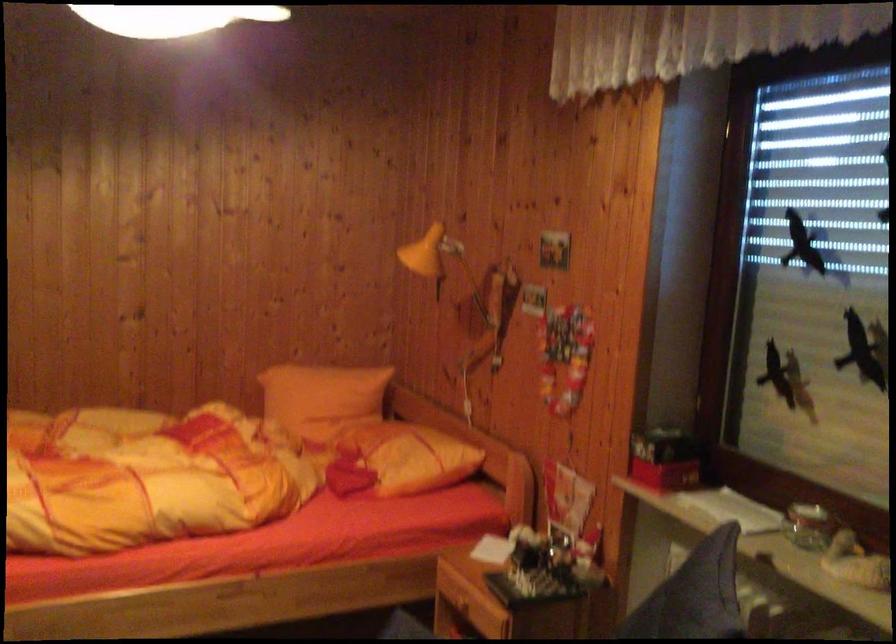
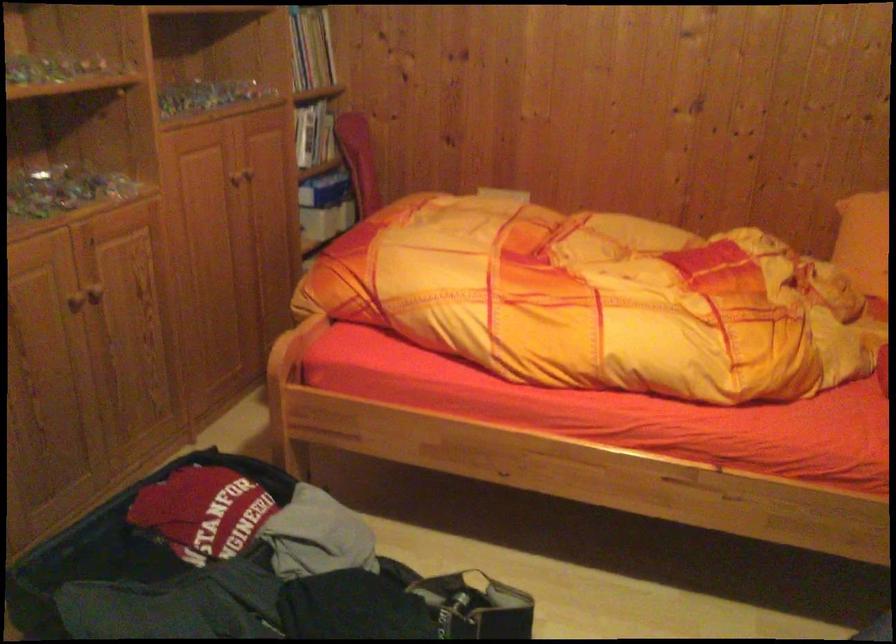
Based on the continuous images, in which direction is the camera rotating?

The camera's rotation is toward left-down.